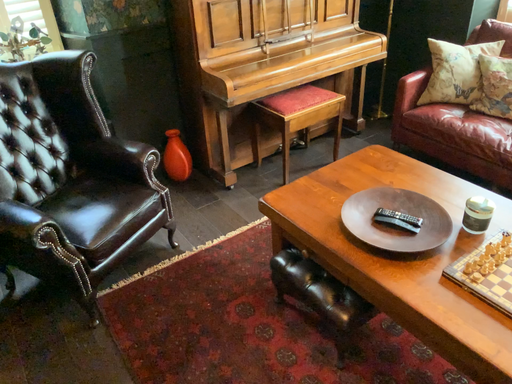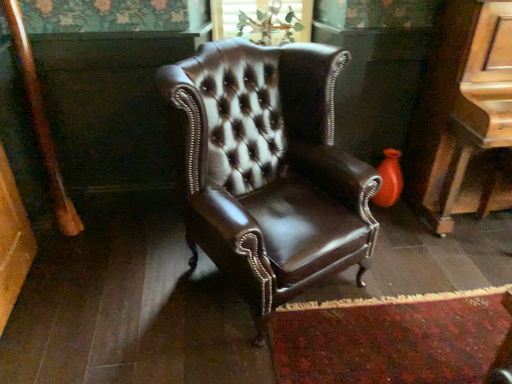
Question: Which way did the camera rotate in the video?

Choices:
 (A) rotated right
 (B) rotated left

Answer: (B)